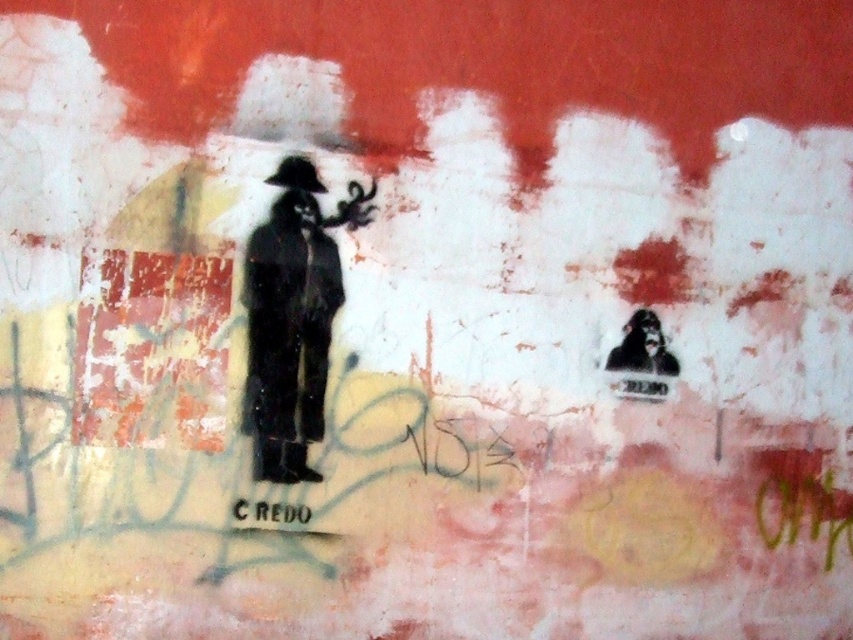
Question: Can you confirm if black matte figure at center is positioned above smooth black mask at upper right?

Choices:
 (A) yes
 (B) no

Answer: (A)

Question: Which point is farther from the camera taking this photo?

Choices:
 (A) (635, 332)
 (B) (302, 230)

Answer: (A)

Question: Can you confirm if black matte figure at center is positioned above smooth black mask at upper right?

Choices:
 (A) no
 (B) yes

Answer: (B)

Question: Can you confirm if black matte figure at center is positioned above smooth black mask at upper right?

Choices:
 (A) no
 (B) yes

Answer: (B)